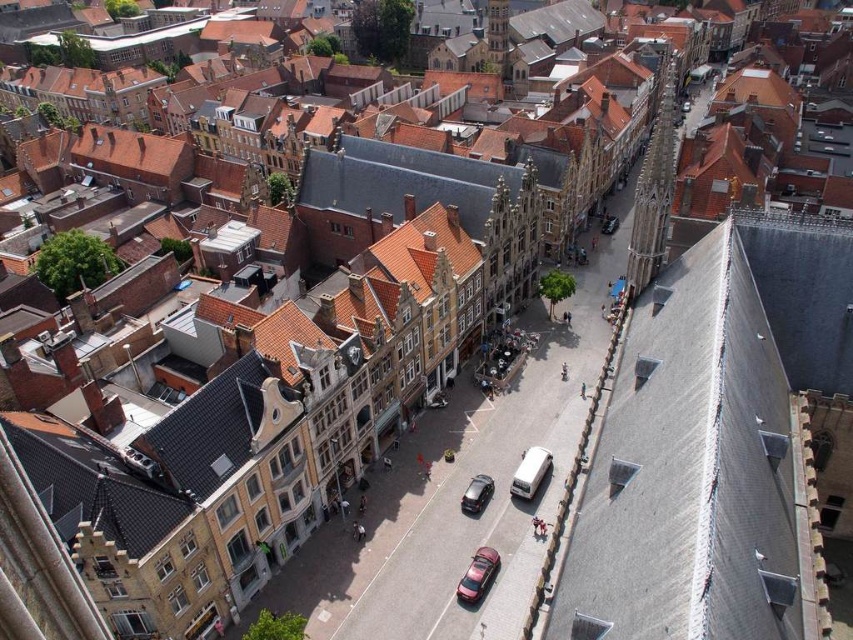
Question: Which of the following is the farthest from the observer?

Choices:
 (A) (473, 588)
 (B) (480, 496)

Answer: (B)

Question: Can you confirm if shiny red car at center is positioned to the right of shiny black car at center?

Choices:
 (A) no
 (B) yes

Answer: (A)

Question: Does white matte van at center-right lie behind shiny black car at center?

Choices:
 (A) no
 (B) yes

Answer: (B)

Question: Can you confirm if shiny red car at center is positioned below shiny black car at center?

Choices:
 (A) yes
 (B) no

Answer: (A)

Question: Which object is farther from the camera taking this photo?

Choices:
 (A) shiny red car at center
 (B) white matte van at center-right
 (C) shiny black car at center

Answer: (B)

Question: Among these objects, which one is farthest from the camera?

Choices:
 (A) shiny black car at center
 (B) white matte van at center-right

Answer: (B)